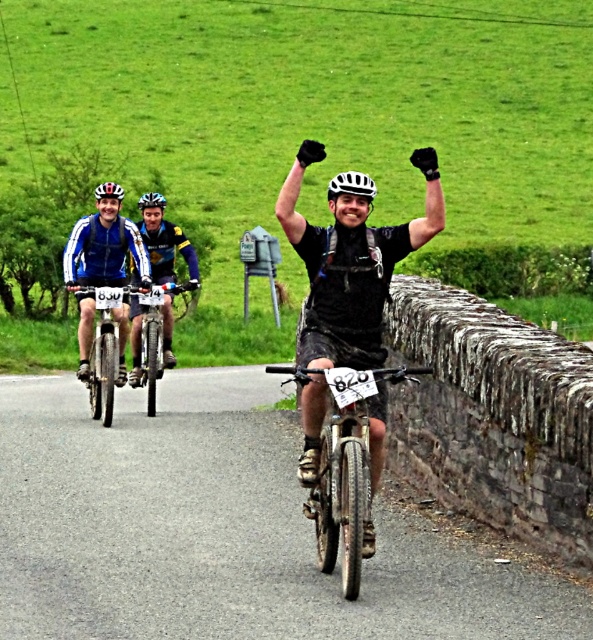
In the scene shown: Measure the distance between metallic silver bicycle at center and white matte bicycle helmet at center.

5.84 meters

Can you confirm if metallic silver bicycle at center is positioned to the right of white matte bicycle helmet at center?

No, metallic silver bicycle at center is not to the right of white matte bicycle helmet at center.

The width and height of the screenshot is (593, 640). Find the location of `metallic silver bicycle at center`. metallic silver bicycle at center is located at coordinates (345, 464).

Can you confirm if blue fabric jacket at left is positioned to the right of matte black bicycle at center?

Incorrect, blue fabric jacket at left is not on the right side of matte black bicycle at center.

Which is behind, point (138, 232) or point (148, 387)?

The point (148, 387) is behind.

Between point (101, 243) and point (141, 340), which one is positioned behind?

Point (141, 340)

This screenshot has height=640, width=593. In order to click on blue fabric jacket at left in this screenshot , I will do coord(103,250).

Describe the element at coordinates (104, 346) in the screenshot. The width and height of the screenshot is (593, 640). I see `matte black bicycle at left` at that location.

Is matte black bicycle at left behind matte black bicycle at center?

No, it is not.

Is point (109, 308) more distant than point (146, 342)?

That is False.

Image resolution: width=593 pixels, height=640 pixels. Identify the location of matte black bicycle at left. (104, 346).